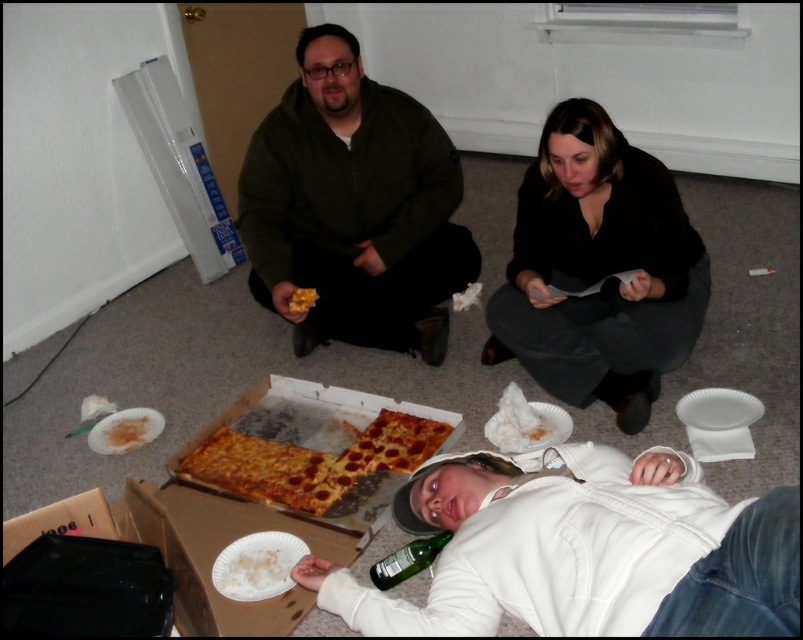
Question: Which point is farther to the camera?

Choices:
 (A) (369, 164)
 (B) (579, 390)
 (C) (443, 538)
 (D) (223, 435)

Answer: (A)

Question: Which object is closer to the camera taking this photo?

Choices:
 (A) cheesy pizza at center
 (B) green fuzzy sweater at center

Answer: (A)

Question: Does dark brown fabric at center appear over yellow cheese pizza at center?

Choices:
 (A) yes
 (B) no

Answer: (A)

Question: Can you confirm if cheesy pizza at center is positioned above green glass bottle at lower center?

Choices:
 (A) no
 (B) yes

Answer: (B)

Question: Which of the following is the closest to the observer?

Choices:
 (A) (292, 458)
 (B) (385, 561)
 (C) (292, 308)

Answer: (B)

Question: Does green fuzzy sweater at center appear over cardboard pizza box at center?

Choices:
 (A) yes
 (B) no

Answer: (A)